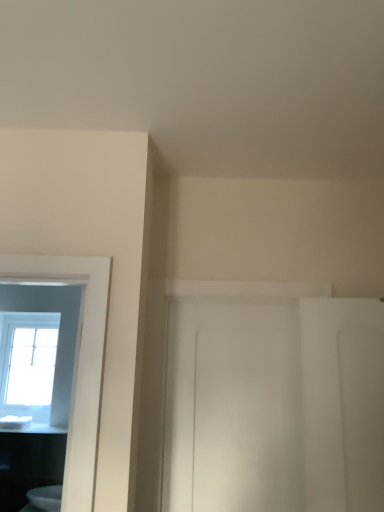
Question: Can you confirm if white glossy toilet at lower left is wider than white glossy countertop at lower left?

Choices:
 (A) no
 (B) yes

Answer: (A)

Question: Is white glossy toilet at lower left aimed at white glossy countertop at lower left?

Choices:
 (A) no
 (B) yes

Answer: (A)

Question: Is the position of white glossy toilet at lower left more distant than that of white glossy countertop at lower left?

Choices:
 (A) yes
 (B) no

Answer: (B)

Question: Considering the relative sizes of white glossy toilet at lower left and white glossy countertop at lower left in the image provided, is white glossy toilet at lower left taller than white glossy countertop at lower left?

Choices:
 (A) no
 (B) yes

Answer: (B)

Question: From a real-world perspective, is white glossy toilet at lower left below white glossy countertop at lower left?

Choices:
 (A) yes
 (B) no

Answer: (A)

Question: From the image's perspective, is white glossy toilet at lower left under white glossy countertop at lower left?

Choices:
 (A) no
 (B) yes

Answer: (B)

Question: From the image's perspective, does clear glass window at left appear higher than white glossy toilet at lower left?

Choices:
 (A) no
 (B) yes

Answer: (B)

Question: Can you see clear glass window at left touching white glossy toilet at lower left?

Choices:
 (A) no
 (B) yes

Answer: (A)

Question: Does clear glass window at left contain white glossy toilet at lower left?

Choices:
 (A) yes
 (B) no

Answer: (B)

Question: Is clear glass window at left wider than white glossy toilet at lower left?

Choices:
 (A) yes
 (B) no

Answer: (B)

Question: Considering the relative sizes of clear glass window at left and white glossy toilet at lower left in the image provided, is clear glass window at left thinner than white glossy toilet at lower left?

Choices:
 (A) no
 (B) yes

Answer: (B)

Question: Can you confirm if clear glass window at left is positioned to the left of white glossy toilet at lower left?

Choices:
 (A) no
 (B) yes

Answer: (B)

Question: Does clear glass window at left turn towards white glossy countertop at lower left?

Choices:
 (A) no
 (B) yes

Answer: (B)